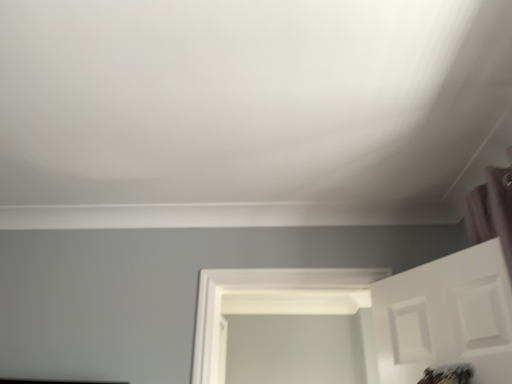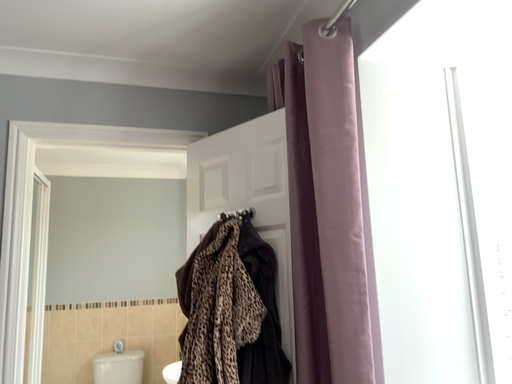
Question: Which way did the camera rotate in the video?

Choices:
 (A) rotated right
 (B) rotated left

Answer: (A)